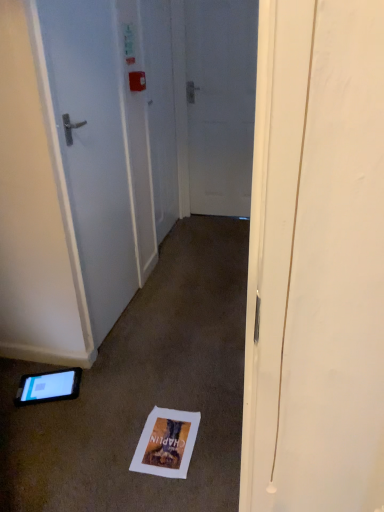
Identify the location of white glossy door at left, which is the second door in right-to-left order. (93, 148).

Image resolution: width=384 pixels, height=512 pixels. Identify the location of white matte door at center, acting as the first door starting from the right. (220, 103).

At what (x,y) coordinates should I click in order to perform the action: click on white glossy door at left, marked as the 2th door in a back-to-front arrangement. Please return your answer as a coordinate pair (x, y). The width and height of the screenshot is (384, 512). Looking at the image, I should click on (93, 148).

Who is shorter, white paper postcard at lower center or white matte door at center, placed as the second door when sorted from left to right?

white paper postcard at lower center is shorter.

Could you tell me if white paper postcard at lower center is facing white matte door at center, placed as the second door when sorted from left to right?

No, white paper postcard at lower center does not turn towards white matte door at center, placed as the second door when sorted from left to right.

Between white paper postcard at lower center and white matte door at center, placed as the second door when sorted from left to right, which one is positioned in front?

white paper postcard at lower center.

Considering the positions of point (180, 467) and point (199, 137), is point (180, 467) closer or farther from the camera than point (199, 137)?

Point (180, 467) is positioned closer to the camera compared to point (199, 137).

From a real-world perspective, who is located higher, black glossy tablet at lower left or white matte door at center, acting as the first door starting from the right?

white matte door at center, acting as the first door starting from the right.

Does black glossy tablet at lower left turn towards white matte door at center, acting as the first door starting from the right?

No, black glossy tablet at lower left is not turned towards white matte door at center, acting as the first door starting from the right.

Can white matte door at center, placed as the second door when sorted from left to right, be found inside black glossy tablet at lower left?

No, white matte door at center, placed as the second door when sorted from left to right, is not surrounded by black glossy tablet at lower left.

From the image's perspective, which one is positioned higher, black glossy tablet at lower left or white matte door at center, acting as the first door starting from the right?

white matte door at center, acting as the first door starting from the right, is shown above in the image.

From the image's perspective, is white matte door at center, which is counted as the first door, starting from the back, on white paper postcard at lower center?

Yes, from the image's perspective, white matte door at center, which is counted as the first door, starting from the back, is over white paper postcard at lower center.

Could white paper postcard at lower center be considered to be inside white matte door at center, the second door positioned from the front?

Actually, white paper postcard at lower center is outside white matte door at center, the second door positioned from the front.

Considering the relative sizes of white matte door at center, placed as the second door when sorted from left to right, and white paper postcard at lower center in the image provided, is white matte door at center, placed as the second door when sorted from left to right, smaller than white paper postcard at lower center?

No, white matte door at center, placed as the second door when sorted from left to right, is not smaller than white paper postcard at lower center.

Based on their sizes in the image, would you say white paper postcard at lower center is bigger or smaller than black glossy tablet at lower left?

white paper postcard at lower center is smaller than black glossy tablet at lower left.

Could you tell me if white paper postcard at lower center is turned towards black glossy tablet at lower left?

No, white paper postcard at lower center is not facing towards black glossy tablet at lower left.

From a real-world perspective, which is physically above, white paper postcard at lower center or black glossy tablet at lower left?

In real-world perspective, black glossy tablet at lower left is above.

Is white glossy door at left, which is the second door in right-to-left order, at the back of black glossy tablet at lower left?

black glossy tablet at lower left does not have its back to white glossy door at left, which is the second door in right-to-left order.

Looking at their sizes, would you say black glossy tablet at lower left is wider or thinner than white glossy door at left, the 1th door in the left-to-right sequence?

In the image, black glossy tablet at lower left appears to be wider than white glossy door at left, the 1th door in the left-to-right sequence.

Is black glossy tablet at lower left outside of white glossy door at left, marked as the 2th door in a back-to-front arrangement?

Yes.

From a real-world perspective, count 1st doors upward from the black glossy tablet at lower left and point to it. Please provide its 2D coordinates.

[(93, 148)]

Which is nearer, (179, 416) or (114, 322)?

Point (179, 416) appears to be closer to the viewer than point (114, 322).

Are white paper postcard at lower center and white glossy door at left, marked as the 2th door in a back-to-front arrangement, making contact?

white paper postcard at lower center and white glossy door at left, marked as the 2th door in a back-to-front arrangement, are not in contact.

Would you say white paper postcard at lower center is outside white glossy door at left, marked as the 1th door in a front-to-back arrangement?

That's correct, white paper postcard at lower center is outside of white glossy door at left, marked as the 1th door in a front-to-back arrangement.

Is white paper postcard at lower center to the right of white glossy door at left, which is the second door in right-to-left order, from the viewer's perspective?

Correct, you'll find white paper postcard at lower center to the right of white glossy door at left, which is the second door in right-to-left order.

Based on the photo, from a real-world perspective, is white glossy door at left, marked as the 1th door in a front-to-back arrangement, located beneath black glossy tablet at lower left?

No, from a real-world perspective, white glossy door at left, marked as the 1th door in a front-to-back arrangement, is not beneath black glossy tablet at lower left.

Which of these two, white glossy door at left, marked as the 1th door in a front-to-back arrangement, or black glossy tablet at lower left, is thinner?

Thinner between the two is white glossy door at left, marked as the 1th door in a front-to-back arrangement.

Can you confirm if white glossy door at left, the 1th door in the left-to-right sequence, is shorter than black glossy tablet at lower left?

Incorrect, the height of white glossy door at left, the 1th door in the left-to-right sequence, does not fall short of that of black glossy tablet at lower left.

Is white glossy door at left, marked as the 1th door in a front-to-back arrangement, not close to black glossy tablet at lower left?

They are positioned close to each other.

Where is `the 2nd door above the white paper postcard at lower center (from the image's perspective)`? The image size is (384, 512). the 2nd door above the white paper postcard at lower center (from the image's perspective) is located at coordinates (220, 103).

The image size is (384, 512). What are the coordinates of `tablet computer on the left side of white matte door at center, acting as the first door starting from the right` in the screenshot? It's located at (48, 387).

Which object lies nearer to the anchor point white matte door at center, the second door positioned from the front, white paper postcard at lower center or black glossy tablet at lower left?

black glossy tablet at lower left is positioned closer to the anchor white matte door at center, the second door positioned from the front.

In the scene shown: Considering their positions, is black glossy tablet at lower left positioned closer to white paper postcard at lower center than white matte door at center, placed as the second door when sorted from left to right?

The object closer to white paper postcard at lower center is black glossy tablet at lower left.

Based on their spatial positions, is white glossy door at left, the 1th door in the left-to-right sequence, or white paper postcard at lower center further from black glossy tablet at lower left?

white glossy door at left, the 1th door in the left-to-right sequence, is further to black glossy tablet at lower left.

From the image, which object appears to be farther from black glossy tablet at lower left, white matte door at center, placed as the second door when sorted from left to right, or white glossy door at left, marked as the 1th door in a front-to-back arrangement?

white matte door at center, placed as the second door when sorted from left to right.

From the image, which object appears to be farther from white paper postcard at lower center, white glossy door at left, which is the second door in right-to-left order, or black glossy tablet at lower left?

white glossy door at left, which is the second door in right-to-left order, is further to white paper postcard at lower center.

From the image, which object appears to be nearer to white paper postcard at lower center, black glossy tablet at lower left or white glossy door at left, marked as the 1th door in a front-to-back arrangement?

black glossy tablet at lower left is closer to white paper postcard at lower center.

From the picture: From the image, which object appears to be nearer to white matte door at center, the second door positioned from the front, white paper postcard at lower center or white glossy door at left, marked as the 1th door in a front-to-back arrangement?

Based on the image, white glossy door at left, marked as the 1th door in a front-to-back arrangement, appears to be nearer to white matte door at center, the second door positioned from the front.

From the image, which object appears to be nearer to white glossy door at left, which is the second door in right-to-left order, white paper postcard at lower center or black glossy tablet at lower left?

black glossy tablet at lower left lies closer to white glossy door at left, which is the second door in right-to-left order, than the other object.

You are a GUI agent. You are given a task and a screenshot of the screen. Output one action in this format:
    pyautogui.click(x=<x>, y=<y>)
    Task: Click on the tablet computer between white glossy door at left, marked as the 2th door in a back-to-front arrangement, and white paper postcard at lower center vertically
    
    Given the screenshot: What is the action you would take?
    pyautogui.click(x=48, y=387)

Where is `door between white matte door at center, which is counted as the first door, starting from the back, and white paper postcard at lower center, in the vertical direction`? door between white matte door at center, which is counted as the first door, starting from the back, and white paper postcard at lower center, in the vertical direction is located at coordinates (93, 148).

You are a GUI agent. You are given a task and a screenshot of the screen. Output one action in this format:
    pyautogui.click(x=<x>, y=<y>)
    Task: Click on the tablet computer between white matte door at center, which is counted as the first door, starting from the back, and white paper postcard at lower center from top to bottom
    This screenshot has width=384, height=512.
    Given the screenshot: What is the action you would take?
    pyautogui.click(x=48, y=387)

Where is `door between white matte door at center, placed as the second door when sorted from left to right, and black glossy tablet at lower left vertically`? door between white matte door at center, placed as the second door when sorted from left to right, and black glossy tablet at lower left vertically is located at coordinates (93, 148).